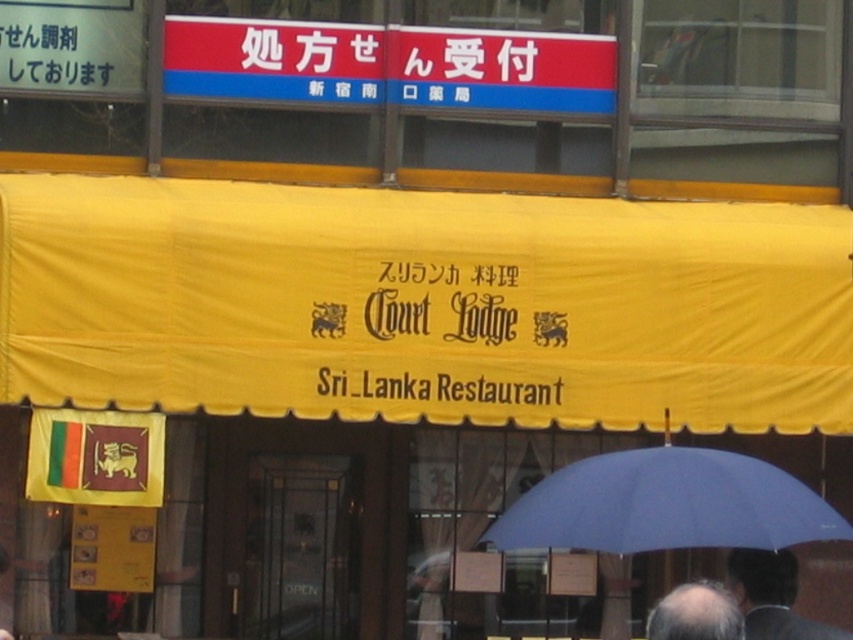
Who is lower down, yellow fabric canopy at center or blue fabric umbrella at lower center?

blue fabric umbrella at lower center is lower down.

Which is in front, point (10, 388) or point (691, 541)?

Point (691, 541) is more forward.

Image resolution: width=853 pixels, height=640 pixels. I want to click on yellow fabric canopy at center, so click(422, 305).

Which is more to the right, blue fabric umbrella at lower center or dark hair at lower right?

dark hair at lower right

Which of these two, blue fabric umbrella at lower center or dark hair at lower right, stands shorter?

With less height is dark hair at lower right.

This screenshot has height=640, width=853. I want to click on blue fabric umbrella at lower center, so click(x=666, y=504).

Identify the location of blue fabric umbrella at lower center. (666, 504).

How distant is yellow fabric canopy at center from bald head at lower center?

yellow fabric canopy at center and bald head at lower center are 3.35 meters apart from each other.

Identify the location of yellow fabric canopy at center. (422, 305).